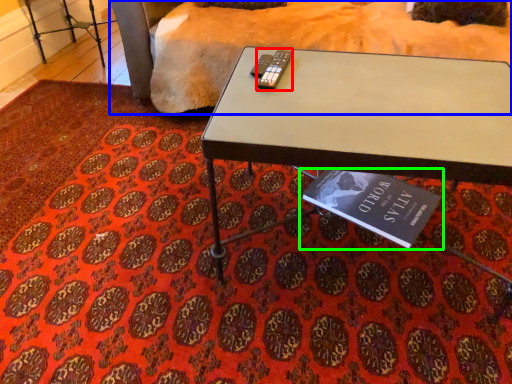
Question: Based on their relative distances, which object is farther from remote (highlighted by a red box)? Choose from bedding (highlighted by a blue box) and book (highlighted by a green box).

Choices:
 (A) bedding
 (B) book

Answer: (A)